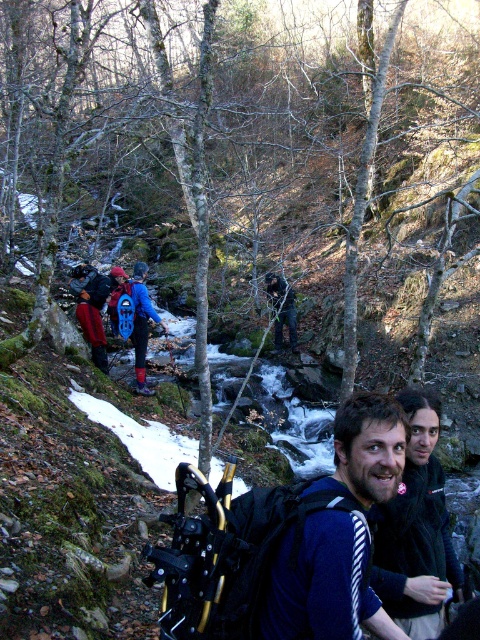
Question: Which object is closer to the camera taking this photo?

Choices:
 (A) blue striped sweater at center
 (B) blue waterproof jacket at center

Answer: (A)

Question: Can you confirm if blue striped sweater at center is positioned below blue waterproof jacket at center?

Choices:
 (A) no
 (B) yes

Answer: (B)

Question: Can you confirm if blue striped sweater at center is positioned above blue waterproof jacket at center?

Choices:
 (A) no
 (B) yes

Answer: (A)

Question: Among these objects, which one is farthest from the camera?

Choices:
 (A) blue striped sweater at center
 (B) blue waterproof jacket at center

Answer: (B)

Question: Which point appears farthest from the camera in this image?

Choices:
 (A) (117, 328)
 (B) (348, 529)

Answer: (A)

Question: Does blue striped sweater at center appear over blue waterproof jacket at center?

Choices:
 (A) no
 (B) yes

Answer: (A)